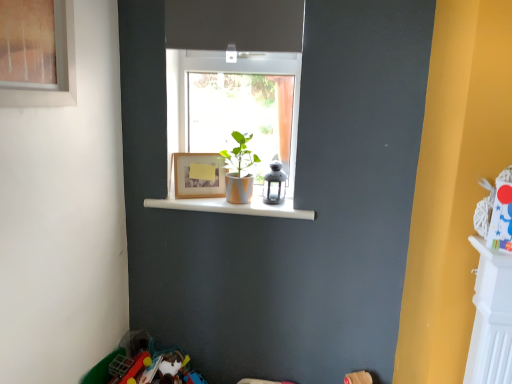
Identify the location of vacant space in matte orange pot at center (from a real-world perspective). The height and width of the screenshot is (384, 512). click(x=238, y=202).